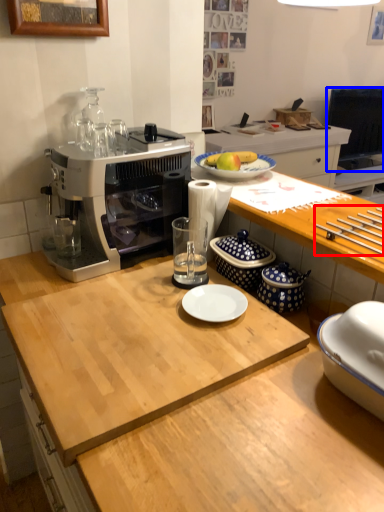
Question: Which of the following is the farthest to the observer, tableware (highlighted by a red box) or television (highlighted by a blue box)?

Choices:
 (A) tableware
 (B) television

Answer: (B)